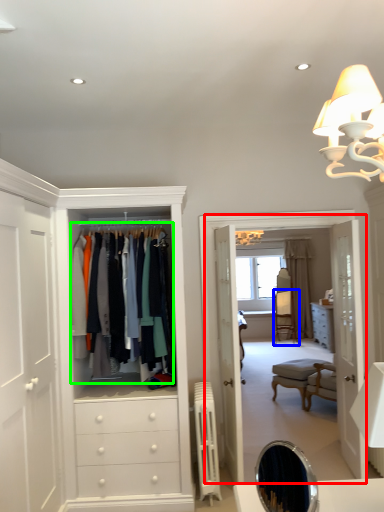
Question: Which object is the farthest from boutique (highlighted by a red box)? Choose among these: armchair (highlighted by a blue box) or clothing (highlighted by a green box).

Choices:
 (A) armchair
 (B) clothing

Answer: (A)